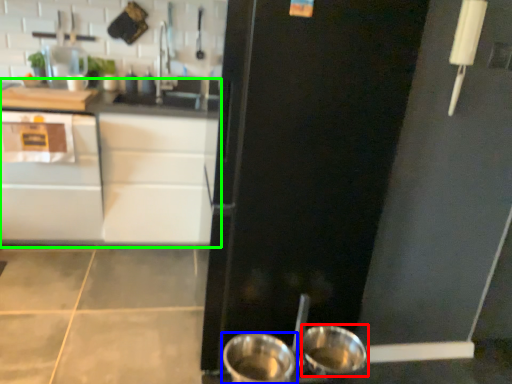
Question: Which is nearer to the basin (highlighted by a red box)? kitchen appliance (highlighted by a blue box) or counter (highlighted by a green box).

Choices:
 (A) kitchen appliance
 (B) counter

Answer: (A)